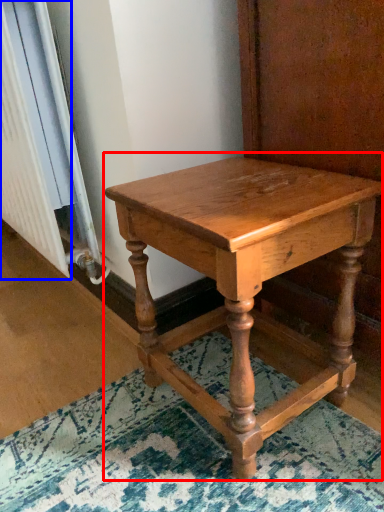
Question: Which object appears closest to the camera in this image, table (highlighted by a red box) or radiator (highlighted by a blue box)?

Choices:
 (A) table
 (B) radiator

Answer: (A)